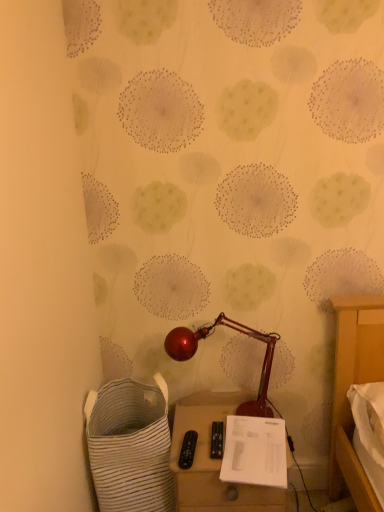
Question: Visually, is matte beige side table at lower center positioned to the left or to the right of shiny metallic lamp at center?

Choices:
 (A) left
 (B) right

Answer: (B)

Question: From the image's perspective, is matte beige side table at lower center located above or below shiny metallic lamp at center?

Choices:
 (A) above
 (B) below

Answer: (B)

Question: Which object is the farthest from the white striped fabric laundry basket at lower left?

Choices:
 (A) shiny metallic lamp at center
 (B) white paper at lower center
 (C) matte beige side table at lower center

Answer: (A)

Question: Based on their relative distances, which object is nearer to the white striped fabric laundry basket at lower left?

Choices:
 (A) white paper at lower center
 (B) shiny metallic lamp at center
 (C) matte beige side table at lower center

Answer: (C)